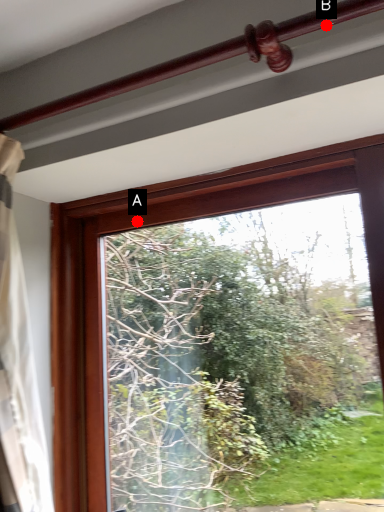
Question: Two points are circled on the image, labeled by A and B beside each circle. Among these points, which one is farthest from the camera?

Choices:
 (A) A is further
 (B) B is further

Answer: (A)